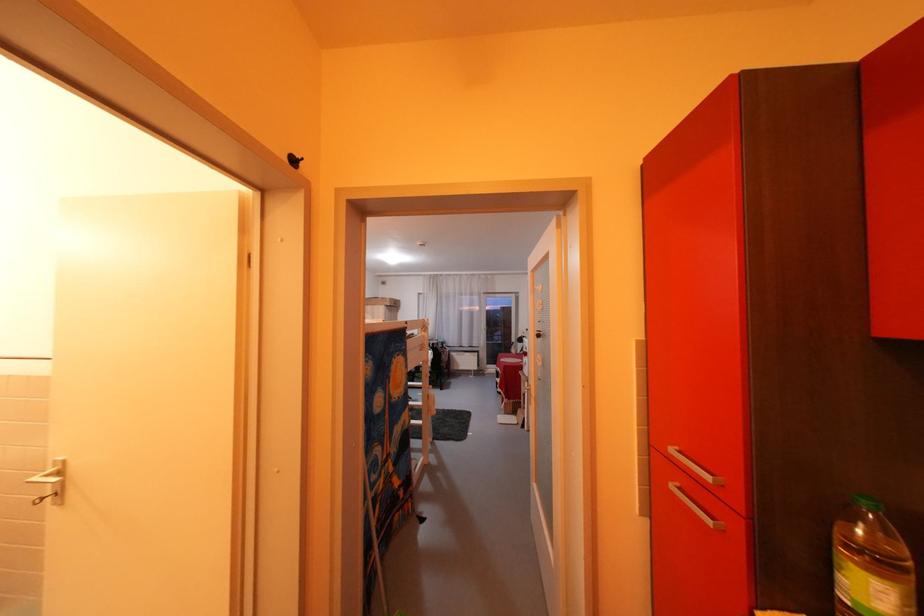
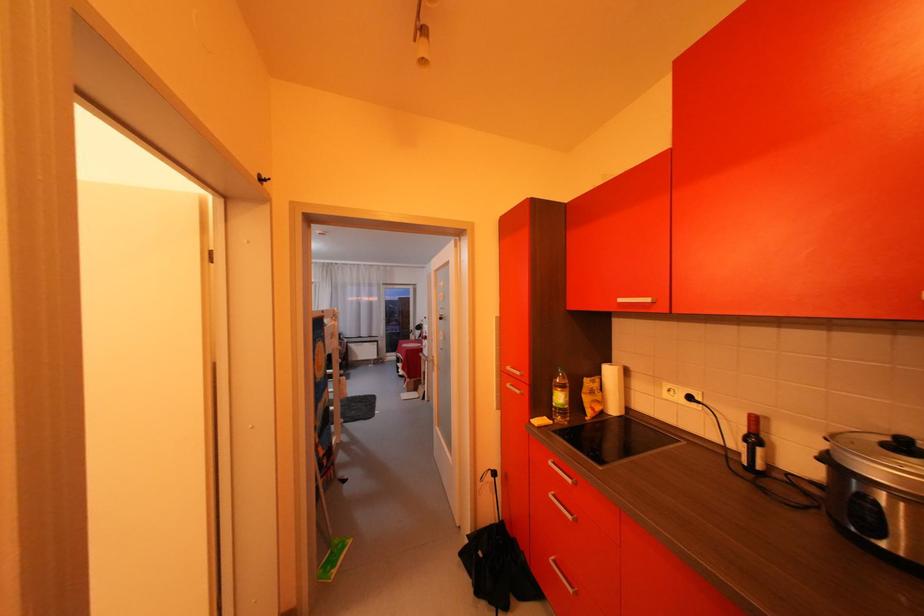
The point at (x=650, y=431) is marked in the first image. Where is the corresponding point in the second image?

(506, 366)